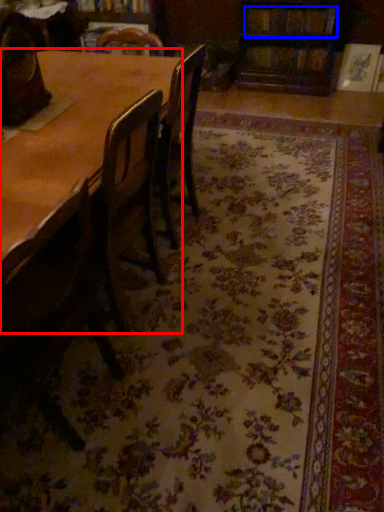
Question: Which point is closer to the camera, table (highlighted by a red box) or book (highlighted by a blue box)?

Choices:
 (A) table
 (B) book

Answer: (A)